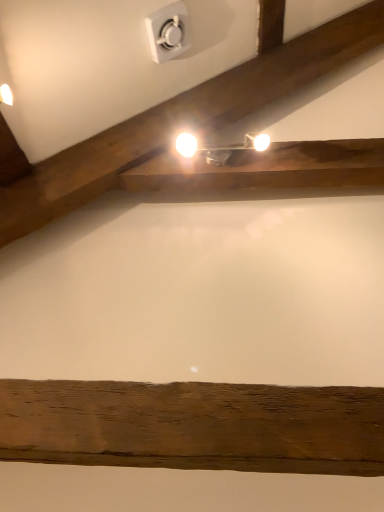
Question: Visually, is matte silver fixture at upper center positioned to the left or to the right of white plastic electric outlet at upper center?

Choices:
 (A) left
 (B) right

Answer: (B)

Question: Looking at their shapes, would you say matte silver fixture at upper center is wider or thinner than white plastic electric outlet at upper center?

Choices:
 (A) wide
 (B) thin

Answer: (A)

Question: From their relative heights in the image, would you say matte silver fixture at upper center is taller or shorter than white plastic electric outlet at upper center?

Choices:
 (A) tall
 (B) short

Answer: (B)

Question: From their relative heights in the image, would you say white plastic electric outlet at upper center is taller or shorter than matte silver fixture at upper center?

Choices:
 (A) tall
 (B) short

Answer: (A)

Question: In the image, is white plastic electric outlet at upper center on the left side or the right side of matte silver fixture at upper center?

Choices:
 (A) left
 (B) right

Answer: (A)

Question: In terms of size, does white plastic electric outlet at upper center appear bigger or smaller than matte silver fixture at upper center?

Choices:
 (A) small
 (B) big

Answer: (B)

Question: From a real-world perspective, relative to matte silver fixture at upper center, is white plastic electric outlet at upper center vertically above or below?

Choices:
 (A) above
 (B) below

Answer: (A)